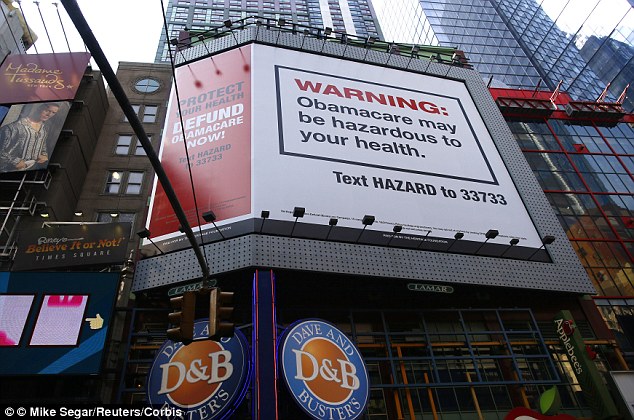
The image size is (634, 420). I want to click on poster, so click(401, 200).